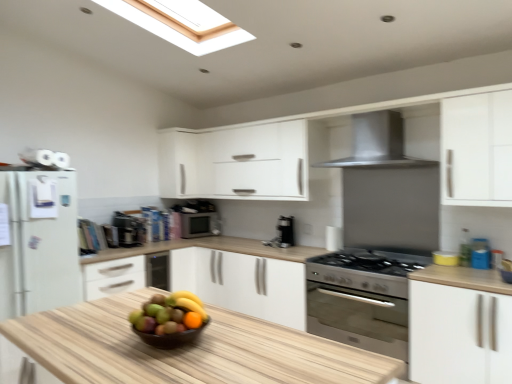
What are the coordinates of `metallic silver microwave at center, the 1th appliance from the back` in the screenshot? It's located at (198, 225).

At what (x,y) coordinates should I click in order to perform the action: click on white matte cabinet at right, which is the first cabinetry from front to back. Please return your answer as a coordinate pair (x, y). Image resolution: width=512 pixels, height=384 pixels. Looking at the image, I should click on (459, 335).

The image size is (512, 384). Describe the element at coordinates (185, 164) in the screenshot. I see `white matte cabinet at upper center, the 2th cabinetry positioned from the bottom` at that location.

Identify the location of satin black coffee maker at center, the second appliance from the right. (128, 230).

Where is `stainless steel range hood at upper center`? The width and height of the screenshot is (512, 384). stainless steel range hood at upper center is located at coordinates (377, 143).

Is metallic silver microwave at center, arranged as the 2th appliance when viewed from the front, far from stainless steel range hood at upper center?

Yes, metallic silver microwave at center, arranged as the 2th appliance when viewed from the front, and stainless steel range hood at upper center are located far from each other.

Looking at their sizes, would you say metallic silver microwave at center, arranged as the 2th appliance when viewed from the left, is wider or thinner than stainless steel range hood at upper center?

metallic silver microwave at center, arranged as the 2th appliance when viewed from the left, is thinner than stainless steel range hood at upper center.

Does metallic silver microwave at center, arranged as the 2th appliance when viewed from the left, turn towards stainless steel range hood at upper center?

No, metallic silver microwave at center, arranged as the 2th appliance when viewed from the left, is not facing towards stainless steel range hood at upper center.

Is shiny brown bowl at center positioned with its back to white matte cabinet at right, the first cabinetry viewed from the right?

That's not correct — shiny brown bowl at center is not looking away from white matte cabinet at right, the first cabinetry viewed from the right.

In order to click on cabinetry located on the right of shiny brown bowl at center in this screenshot , I will do (459, 335).

Considering the relative positions of shiny brown bowl at center and white matte cabinet at right, which is the 1th cabinetry in bottom-to-top order, in the image provided, is shiny brown bowl at center to the right of white matte cabinet at right, which is the 1th cabinetry in bottom-to-top order, from the viewer's perspective?

Incorrect, shiny brown bowl at center is not on the right side of white matte cabinet at right, which is the 1th cabinetry in bottom-to-top order.

Is shiny brown bowl at center touching white matte cabinet at right, the first cabinetry viewed from the right?

No, shiny brown bowl at center is not with white matte cabinet at right, the first cabinetry viewed from the right.

Is white matte cabinet at right, which is the first cabinetry from front to back, closer to the viewer compared to white matte cabinet at upper center, the 2th cabinetry when ordered from right to left?

Yes, white matte cabinet at right, which is the first cabinetry from front to back, is closer to the camera.

Considering the relative sizes of white matte cabinet at right, which ranks as the second cabinetry in back-to-front order, and white matte cabinet at upper center, the second cabinetry from the front, in the image provided, is white matte cabinet at right, which ranks as the second cabinetry in back-to-front order, smaller than white matte cabinet at upper center, the second cabinetry from the front,?

No.

Can you tell me how much white matte cabinet at right, which is the 1th cabinetry in bottom-to-top order, and white matte cabinet at upper center, the first cabinetry when ordered from left to right, differ in facing direction?

white matte cabinet at right, which is the 1th cabinetry in bottom-to-top order, and white matte cabinet at upper center, the first cabinetry when ordered from left to right, are facing 89.9 degrees away from each other.

From the image's perspective, between white matte cabinet at right, which is the first cabinetry from front to back, and white matte cabinet at upper center, the first cabinetry when ordered from left to right, which one is located above?

white matte cabinet at upper center, the first cabinetry when ordered from left to right, from the image's perspective.

Where is `cabinetry on the right of white matte cabinet at upper center, the first cabinetry when ordered from left to right`? This screenshot has width=512, height=384. cabinetry on the right of white matte cabinet at upper center, the first cabinetry when ordered from left to right is located at coordinates (459, 335).

Which is closer, (x=159, y=170) or (x=472, y=338)?

Clearly, point (x=159, y=170) is more distant from the camera than point (x=472, y=338).

Is white matte cabinet at upper center, the first cabinetry positioned from the back, oriented towards white matte cabinet at right, the first cabinetry viewed from the right?

Yes, white matte cabinet at upper center, the first cabinetry positioned from the back, is oriented towards white matte cabinet at right, the first cabinetry viewed from the right.

Considering the relative positions of white matte cabinet at upper center, the first cabinetry positioned from the back, and white matte cabinet at right, the first cabinetry viewed from the right, in the image provided, is white matte cabinet at upper center, the first cabinetry positioned from the back, in front of white matte cabinet at right, the first cabinetry viewed from the right,?

No, it is not.

Which is correct: white matte cabinet at right, which is counted as the 2th cabinetry, starting from the left, is inside shiny brown bowl at center, or outside of it?

white matte cabinet at right, which is counted as the 2th cabinetry, starting from the left, is not enclosed by shiny brown bowl at center.

Considering the sizes of white matte cabinet at right, which is the first cabinetry from front to back, and shiny brown bowl at center in the image, is white matte cabinet at right, which is the first cabinetry from front to back, wider or thinner than shiny brown bowl at center?

Clearly, white matte cabinet at right, which is the first cabinetry from front to back, has more width compared to shiny brown bowl at center.

Is white matte cabinet at right, which is the 1th cabinetry in bottom-to-top order, positioned with its back to shiny brown bowl at center?

No, white matte cabinet at right, which is the 1th cabinetry in bottom-to-top order, is not facing away from shiny brown bowl at center.

Is white matte cabinet at right, which is the 1th cabinetry in bottom-to-top order, to the left or to the right of shiny brown bowl at center in the image?

Clearly, white matte cabinet at right, which is the 1th cabinetry in bottom-to-top order, is on the right of shiny brown bowl at center in the image.

Which of these two, satin black coffee maker at center, positioned as the 1th appliance in front-to-back order, or shiny brown bowl at center, stands shorter?

shiny brown bowl at center is shorter.

Which point is more distant from viewer, (139, 225) or (147, 333)?

Positioned behind is point (139, 225).

From the picture: Is shiny brown bowl at center inside satin black coffee maker at center, positioned as the 1th appliance in front-to-back order?

No.

Is there a large distance between satin black coffee maker at center, positioned as the 2th appliance in back-to-front order, and shiny brown bowl at center?

→ Yes, satin black coffee maker at center, positioned as the 2th appliance in back-to-front order, and shiny brown bowl at center are quite far apart.

Is stainless steel range hood at upper center a part of satin black coffee maker at center, positioned as the 1th appliance in front-to-back order?

No, satin black coffee maker at center, positioned as the 1th appliance in front-to-back order, does not contain stainless steel range hood at upper center.

From the image's perspective, which is below, satin black coffee maker at center, positioned as the 1th appliance in front-to-back order, or stainless steel range hood at upper center?

From the image's view, satin black coffee maker at center, positioned as the 1th appliance in front-to-back order, is below.

Considering the relative sizes of satin black coffee maker at center, positioned as the 2th appliance in back-to-front order, and stainless steel range hood at upper center in the image provided, is satin black coffee maker at center, positioned as the 2th appliance in back-to-front order, taller than stainless steel range hood at upper center?

No, satin black coffee maker at center, positioned as the 2th appliance in back-to-front order, is not taller than stainless steel range hood at upper center.

Who is smaller, satin black coffee maker at center, positioned as the 1th appliance in front-to-back order, or stainless steel range hood at upper center?

Smaller between the two is satin black coffee maker at center, positioned as the 1th appliance in front-to-back order.

Identify the location of the 2nd appliance positioned below the stainless steel range hood at upper center (from a real-world perspective). (198, 225).

Image resolution: width=512 pixels, height=384 pixels. I want to click on fruit dish in front of the white matte cabinet at right, which is counted as the 2th cabinetry, starting from the left, so click(x=169, y=321).

In the scene shown: Estimate the real-world distances between objects in this image. Which object is further from shiny brown bowl at center, stainless steel range hood at upper center or satin black coffee maker at center, the second appliance from the right?

satin black coffee maker at center, the second appliance from the right, lies further to shiny brown bowl at center than the other object.

When comparing their distances from white matte cabinet at upper center, which appears as the first cabinetry when viewed from the top, does shiny brown bowl at center or stainless steel range hood at upper center seem further?

shiny brown bowl at center is further to white matte cabinet at upper center, which appears as the first cabinetry when viewed from the top.

Looking at the image, which one is located further to metallic silver microwave at center, arranged as the 1th appliance when viewed from the right, white matte cabinet at upper center, the first cabinetry when ordered from left to right, or satin black coffee maker at center, positioned as the 2th appliance in back-to-front order?

Among the two, satin black coffee maker at center, positioned as the 2th appliance in back-to-front order, is located further to metallic silver microwave at center, arranged as the 1th appliance when viewed from the right.

Looking at this image, looking at the image, which one is located closer to metallic silver microwave at center, arranged as the 1th appliance when viewed from the right, satin black coffee maker at center, which appears as the first appliance when viewed from the left, or white matte cabinet at upper center, the 2th cabinetry positioned from the bottom?

The object closer to metallic silver microwave at center, arranged as the 1th appliance when viewed from the right, is white matte cabinet at upper center, the 2th cabinetry positioned from the bottom.

From the image, which object appears to be farther from stainless steel range hood at upper center, satin black coffee maker at center, which appears as the first appliance when viewed from the left, or white matte cabinet at upper center, which appears as the first cabinetry when viewed from the top?

Based on the image, satin black coffee maker at center, which appears as the first appliance when viewed from the left, appears to be further to stainless steel range hood at upper center.

Considering their positions, is white matte cabinet at right, which is the first cabinetry from front to back, positioned further to stainless steel range hood at upper center than satin black coffee maker at center, positioned as the 1th appliance in front-to-back order?

satin black coffee maker at center, positioned as the 1th appliance in front-to-back order, lies further to stainless steel range hood at upper center than the other object.

From the image, which object appears to be nearer to white matte cabinet at right, which ranks as the second cabinetry in back-to-front order, stainless steel range hood at upper center or metallic silver microwave at center, arranged as the 1th appliance when viewed from the right?

stainless steel range hood at upper center is closer to white matte cabinet at right, which ranks as the second cabinetry in back-to-front order.

When comparing their distances from metallic silver microwave at center, the 1th appliance from the back, does satin black coffee maker at center, positioned as the 1th appliance in front-to-back order, or white matte cabinet at right, which is the 2th cabinetry from top to bottom, seem further?

Based on the image, white matte cabinet at right, which is the 2th cabinetry from top to bottom, appears to be further to metallic silver microwave at center, the 1th appliance from the back.

At what (x,y) coordinates should I click in order to perform the action: click on appliance between shiny brown bowl at center and metallic silver microwave at center, the 1th appliance from the back, along the z-axis. Please return your answer as a coordinate pair (x, y). The height and width of the screenshot is (384, 512). Looking at the image, I should click on (128, 230).

Locate an element on the screen. This screenshot has width=512, height=384. appliance between shiny brown bowl at center and white matte cabinet at upper center, the 2th cabinetry when ordered from right to left, in the front-back direction is located at coordinates (128, 230).

At what (x,y) coordinates should I click in order to perform the action: click on fruit dish between satin black coffee maker at center, positioned as the 2th appliance in back-to-front order, and white matte cabinet at right, which ranks as the second cabinetry in back-to-front order. Please return your answer as a coordinate pair (x, y). The height and width of the screenshot is (384, 512). Looking at the image, I should click on (169, 321).

Where is `appliance that lies between white matte cabinet at upper center, the 2th cabinetry positioned from the bottom, and metallic silver microwave at center, the 1th appliance from the back, from top to bottom`? appliance that lies between white matte cabinet at upper center, the 2th cabinetry positioned from the bottom, and metallic silver microwave at center, the 1th appliance from the back, from top to bottom is located at coordinates (128, 230).